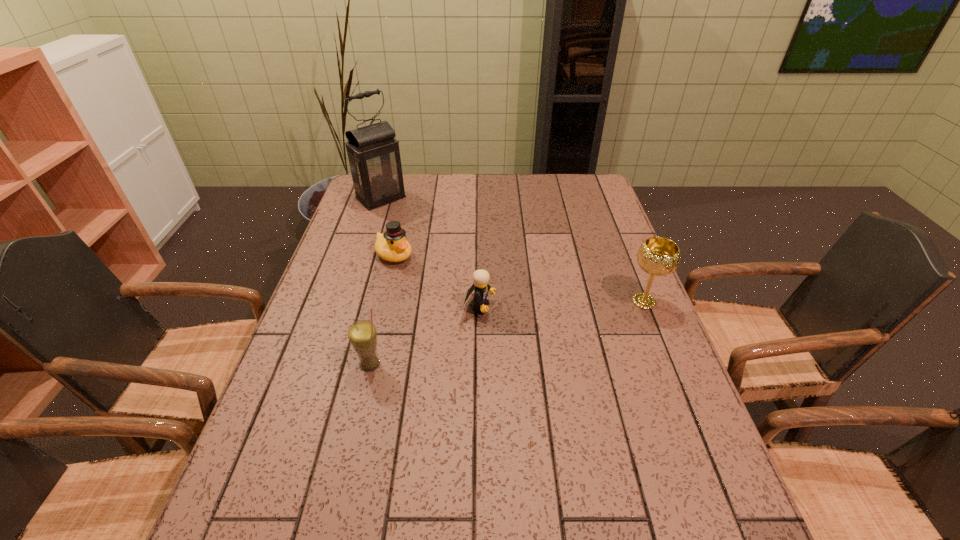
Where is `object at the right edge`? The height and width of the screenshot is (540, 960). object at the right edge is located at coordinates (658, 256).

Identify the location of object present at the far left corner. (374, 157).

Find the location of `free space at the far edge`. free space at the far edge is located at coordinates (458, 190).

The width and height of the screenshot is (960, 540). Identify the location of free space at the near edge of the desktop. (397, 456).

What are the coordinates of `vacant region at the left edge of the desktop` in the screenshot? It's located at (372, 228).

Locate an element on the screen. Image resolution: width=960 pixels, height=540 pixels. free region at the right edge of the desktop is located at coordinates pyautogui.click(x=631, y=281).

This screenshot has width=960, height=540. I want to click on vacant region at the far left corner, so click(392, 203).

Identify the location of vacant space at the near left corner of the desktop. This screenshot has width=960, height=540. (256, 462).

Where is `free space between the nearest object and the second farthest object`? This screenshot has height=540, width=960. free space between the nearest object and the second farthest object is located at coordinates (382, 309).

Locate an element on the screen. unoccupied area between the tallest object and the chalice is located at coordinates (513, 249).